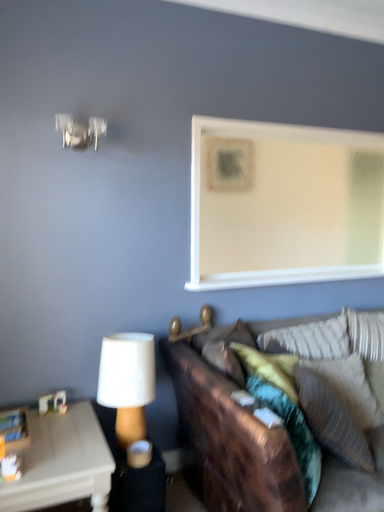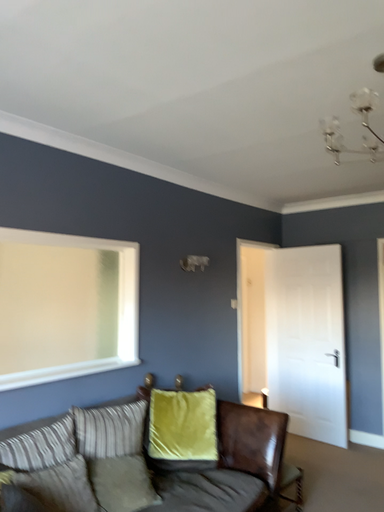
Question: How did the camera likely rotate when shooting the video?

Choices:
 (A) rotated downward
 (B) rotated upward

Answer: (B)